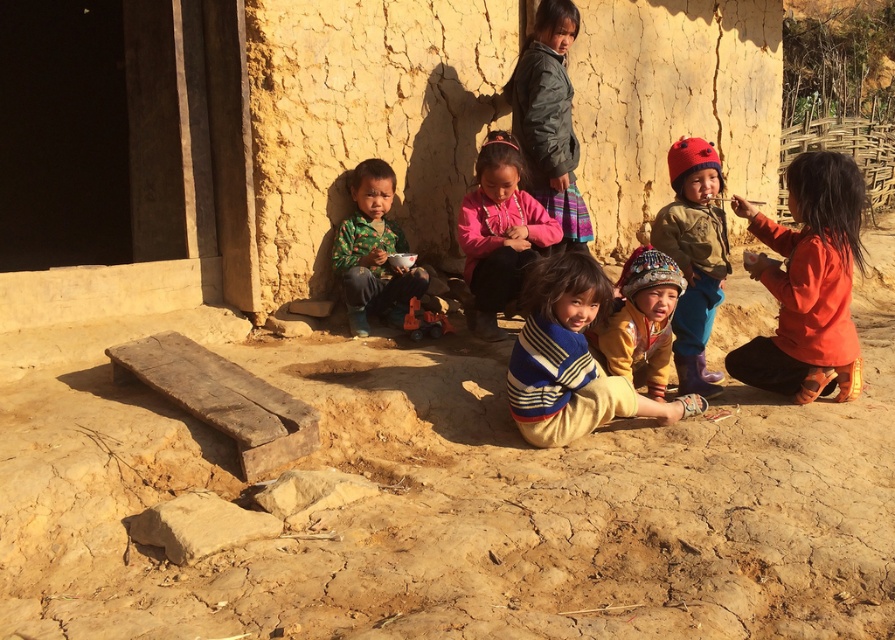
Is point (662, 420) farther from viewer compared to point (287, 513)?

Yes.

Can you confirm if striped sweater at center is smaller than brown rough stone at center?

Incorrect, striped sweater at center is not smaller in size than brown rough stone at center.

Which is in front, point (576, 396) or point (276, 513)?

Point (276, 513)

I want to click on striped sweater at center, so click(570, 358).

Between pink fleece jacket at center and knitted yellow sweater at center, which one appears on the right side from the viewer's perspective?

knitted yellow sweater at center is more to the right.

Who is lower down, pink fleece jacket at center or knitted yellow sweater at center?

knitted yellow sweater at center is below.

Between point (476, 314) and point (654, 289), which one is positioned behind?

Point (476, 314)

Where is `pink fleece jacket at center`? pink fleece jacket at center is located at coordinates (499, 232).

Who is lower down, pink fleece jacket at center or brown rough stone at center?

brown rough stone at center

Does pink fleece jacket at center appear on the right side of brown rough stone at center?

Yes, pink fleece jacket at center is to the right of brown rough stone at center.

Is point (504, 264) positioned before point (260, 492)?

No, (504, 264) is further to viewer.

Find the location of a particular element. pink fleece jacket at center is located at coordinates (499, 232).